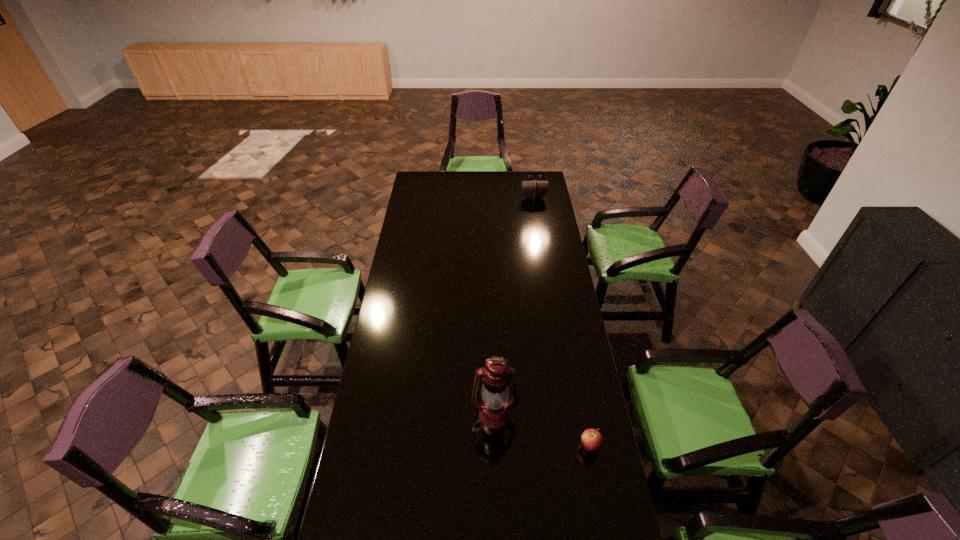
Where is `apple at the right edge`? apple at the right edge is located at coordinates (592, 440).

Find the location of a particular element. vacant space at the far edge of the desktop is located at coordinates (498, 187).

You are a GUI agent. You are given a task and a screenshot of the screen. Output one action in this format:
    pyautogui.click(x=<x>, y=<y>)
    Task: Click on the vacant space at the left edge of the desktop
    This screenshot has height=540, width=960.
    Given the screenshot: What is the action you would take?
    pyautogui.click(x=418, y=318)

Locate an element on the screen. blank space at the right edge is located at coordinates (534, 262).

This screenshot has height=540, width=960. I want to click on free space at the far right corner of the desktop, so click(x=538, y=179).

Where is `empty space that is in between the second shortest object and the oil lamp`? The height and width of the screenshot is (540, 960). empty space that is in between the second shortest object and the oil lamp is located at coordinates (514, 307).

I want to click on empty location between the shortest object and the tallest object, so click(542, 431).

Locate an element on the screen. The height and width of the screenshot is (540, 960). free area in between the second tallest object and the apple is located at coordinates (562, 322).

Locate an element on the screen. This screenshot has height=540, width=960. free spot between the nearest object and the tallest object is located at coordinates (542, 431).

Image resolution: width=960 pixels, height=540 pixels. I want to click on free spot between the shortest object and the leftmost object, so click(542, 431).